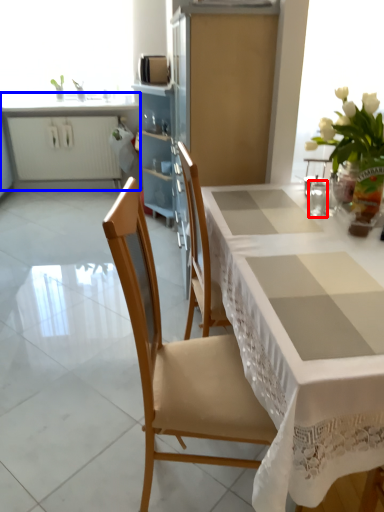
Question: Which point is further to the camera, tableware (highlighted by a red box) or cabinetry (highlighted by a blue box)?

Choices:
 (A) tableware
 (B) cabinetry

Answer: (B)